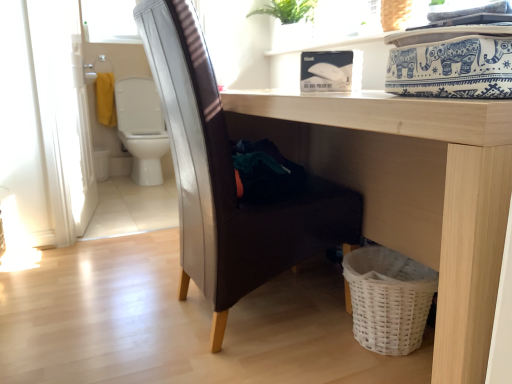
Question: Considering the positions of white glossy screen door at left and leather-like brown chair at center in the image, is white glossy screen door at left wider or thinner than leather-like brown chair at center?

Choices:
 (A) wide
 (B) thin

Answer: (B)

Question: Considering the positions of white glossy screen door at left and leather-like brown chair at center in the image, is white glossy screen door at left bigger or smaller than leather-like brown chair at center?

Choices:
 (A) small
 (B) big

Answer: (A)

Question: Which of these objects is positioned closest to the light wood table at lower center?

Choices:
 (A) transparent glass window screen at upper left
 (B) white glossy screen door at left
 (C) leather-like brown chair at center
 (D) white glossy toilet at left

Answer: (C)

Question: Estimate the real-world distances between objects in this image. Which object is closer to the white glossy toilet at left?

Choices:
 (A) white glossy screen door at left
 (B) leather-like brown chair at center
 (C) light wood table at lower center
 (D) transparent glass window screen at upper left

Answer: (D)